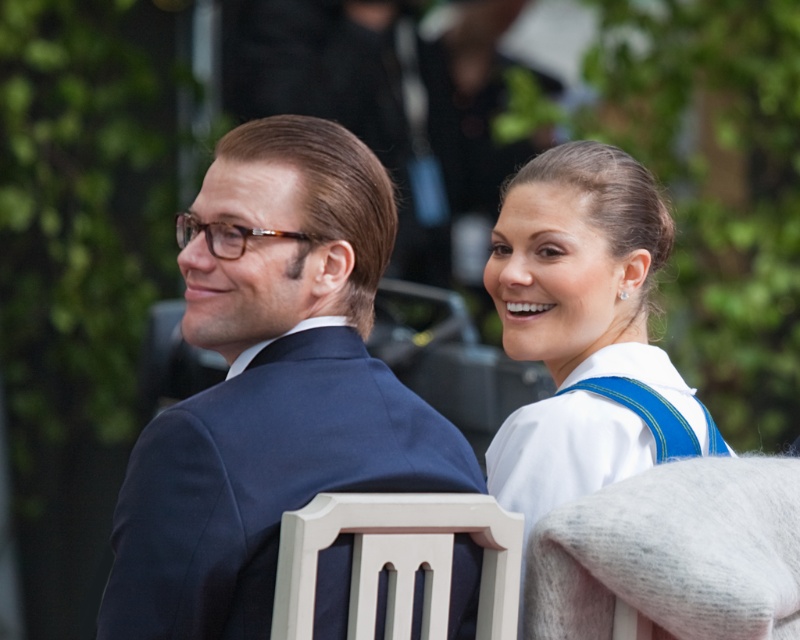
Does navy blue suit at left have a lesser width compared to white painted wood chair at center?

No, navy blue suit at left is not thinner than white painted wood chair at center.

Who is higher up, navy blue suit at left or white painted wood chair at center?

navy blue suit at left is above.

The height and width of the screenshot is (640, 800). I want to click on navy blue suit at left, so click(x=270, y=385).

Consider the image. Is white fabric dress at upper right to the left of white painted wood chair at center from the viewer's perspective?

No, white fabric dress at upper right is not to the left of white painted wood chair at center.

Who is taller, white fabric dress at upper right or white painted wood chair at center?

white fabric dress at upper right is taller.

Between point (610, 353) and point (370, 522), which one is positioned behind?

Positioned behind is point (610, 353).

Locate an element on the screen. The width and height of the screenshot is (800, 640). white fabric dress at upper right is located at coordinates (586, 330).

Can you confirm if navy blue suit at left is taller than white fabric dress at upper right?

Indeed, navy blue suit at left has a greater height compared to white fabric dress at upper right.

Is navy blue suit at left above white fabric dress at upper right?

Yes, navy blue suit at left is above white fabric dress at upper right.

The image size is (800, 640). What are the coordinates of `navy blue suit at left` in the screenshot? It's located at (270, 385).